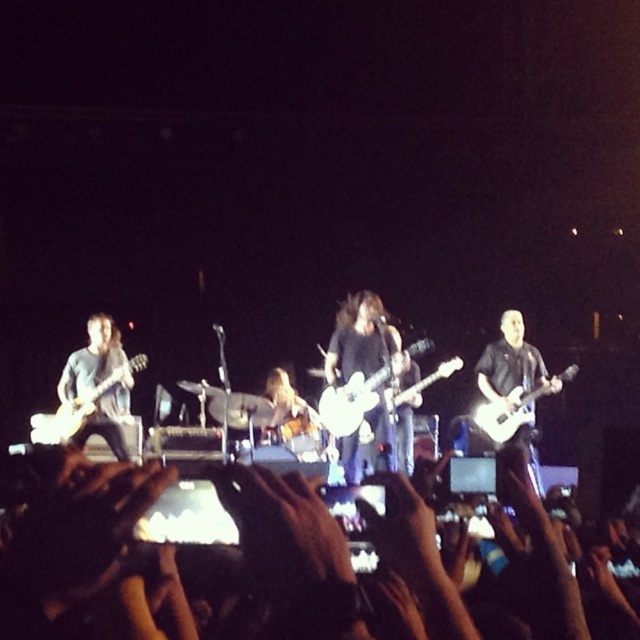
You are a stagehand who needs to move a 1.5 meter long ladder between the matte black guitar at right and the white matte electric guitar at center. Can you fit the ladder horizontally between them without tilting it?

The distance between the matte black guitar at right and the white matte electric guitar at center is 1.57 meters. Since the ladder is 1.5 meters long, it can fit horizontally between them without tilting.

You are a photographer at the concert and want to take a photo of the drummer. You notice two points marked in the scene. Which point should you focus on to ensure the drummer is in focus? The points are point 1 at coordinates point (349, 298) and point 2 at coordinates point (515, 348). Please choose between point 1 or point 2.

You should focus on point 1 at coordinates point (349, 298) because it is closer to the camera than point 2 at coordinates point (515, 348). Since the drummer is mid performance, focusing on the closer point will ensure better clarity.